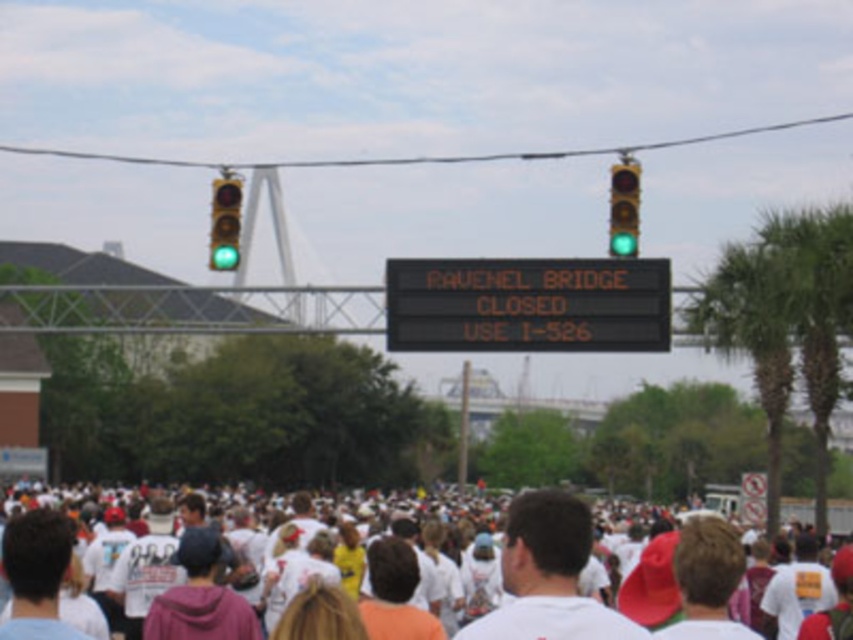
Question: Is white cotton crowd at lower center above green glass traffic light at upper center?

Choices:
 (A) yes
 (B) no

Answer: (B)

Question: Estimate the real-world distances between objects in this image. Which object is closer to the black electronic scoreboard at center?

Choices:
 (A) white cotton crowd at lower center
 (B) green glass traffic light at upper center

Answer: (B)

Question: Is white cotton crowd at lower center wider than green glass traffic light at upper center?

Choices:
 (A) yes
 (B) no

Answer: (A)

Question: Can you confirm if black electronic scoreboard at center is positioned to the right of green glass traffic light at upper center?

Choices:
 (A) yes
 (B) no

Answer: (B)

Question: Estimate the real-world distances between objects in this image. Which object is closer to the black electronic scoreboard at center?

Choices:
 (A) green glass traffic light at left
 (B) white cotton crowd at lower center
 (C) green glass traffic light at upper center

Answer: (C)

Question: Which point is closer to the camera?

Choices:
 (A) (175, 561)
 (B) (407, 349)

Answer: (A)